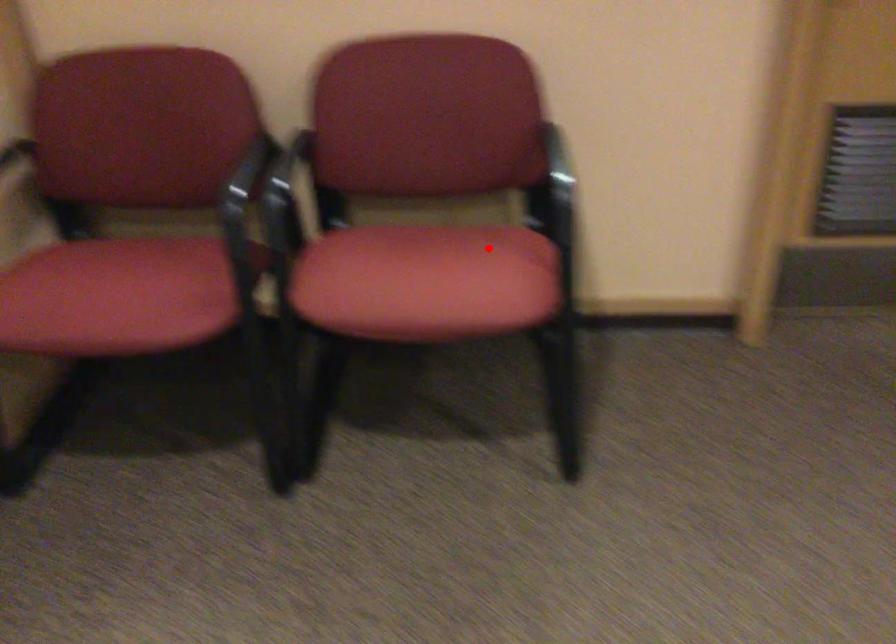
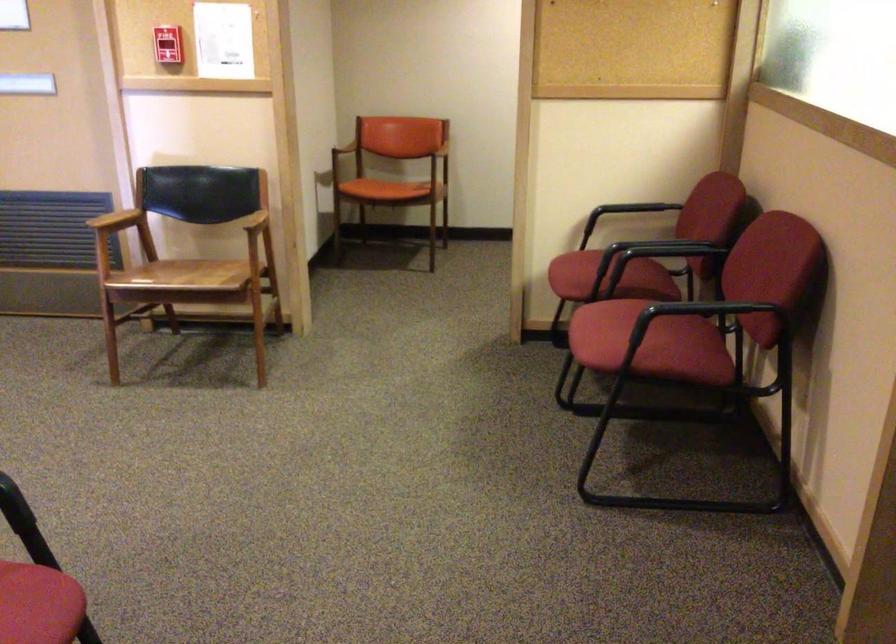
Locate, in the second image, the point that corresponds to the highlighted location in the first image.

(650, 343)